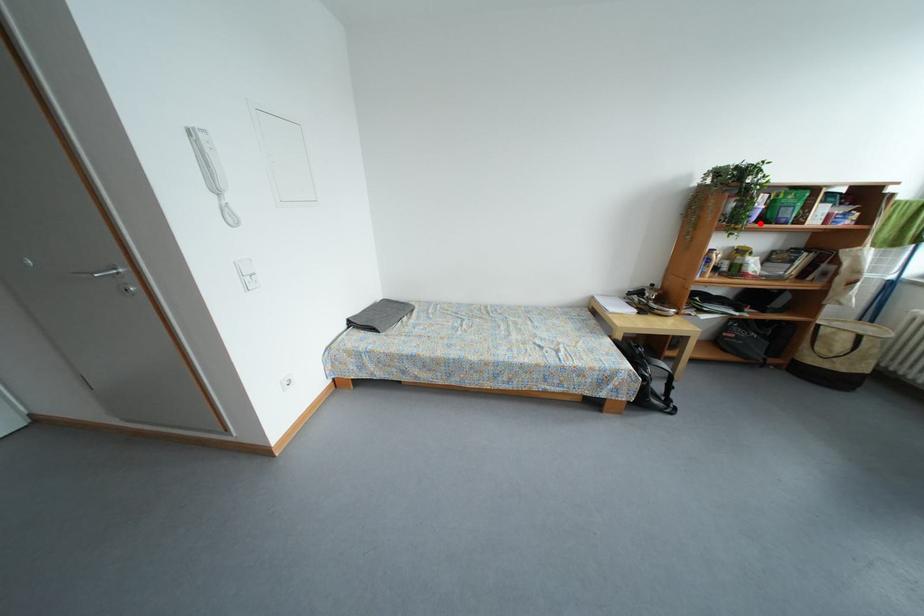
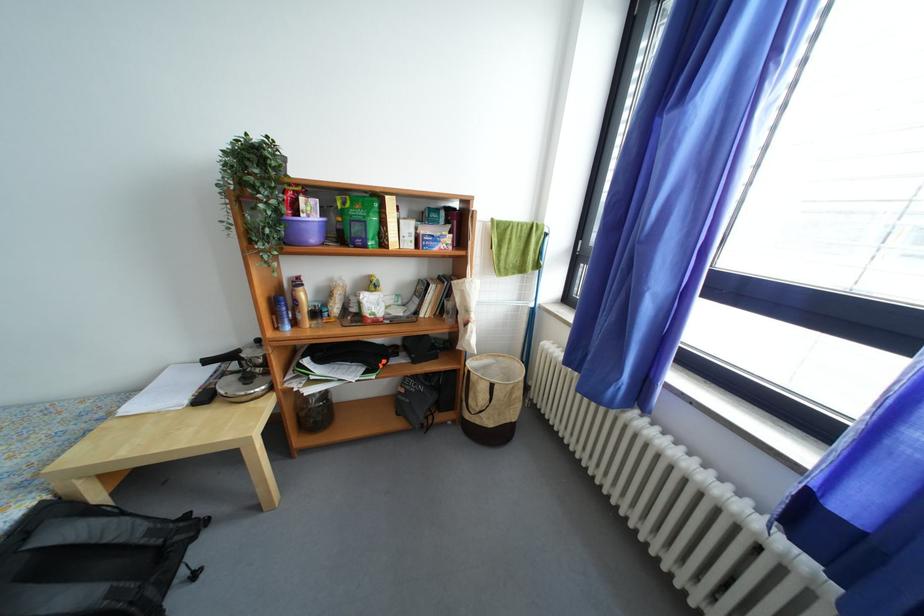
Where in the second image is the point corresponding to the highlighted location from the first image?

(320, 243)